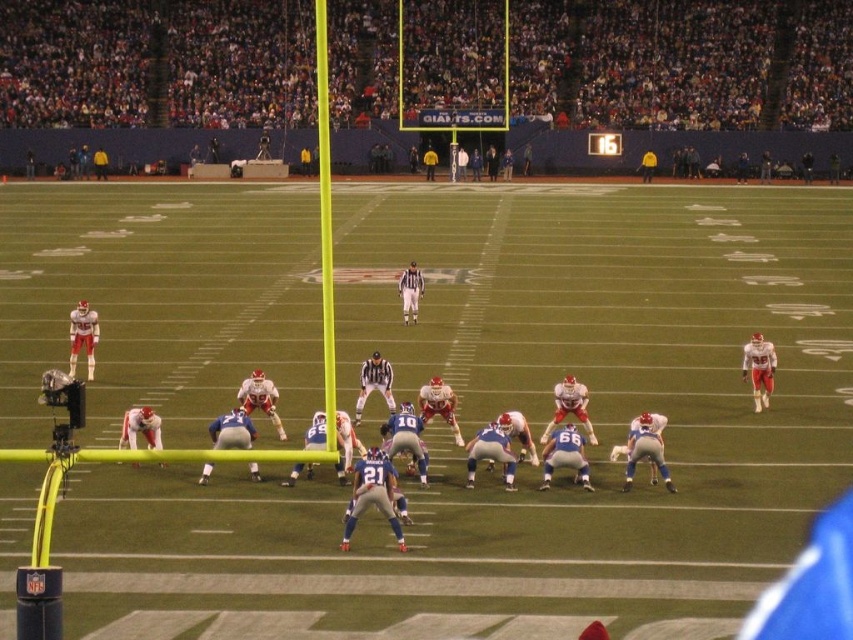
You are a player on the field and need to quickly reach the white striped referee at center from your current position near the matte white helmet at right. What is the shortest distance you must cover?

The shortest distance you must cover to reach the white striped referee at center from the matte white helmet at right is 8.39 meters.

You are a player on the field during the football game. You notice a matte white helmet at right and a white striped referee at center. Which object is closer to you as you stand on the field?

The matte white helmet at right is closer to you because it is in front of the white striped referee at center.

You are a player on the field during a night football game. You notice a matte white helmet at right and a white striped referee at center. Which object is positioned lower from your viewpoint?

The matte white helmet at right is located below the white striped referee at center, so it is positioned lower from your viewpoint.